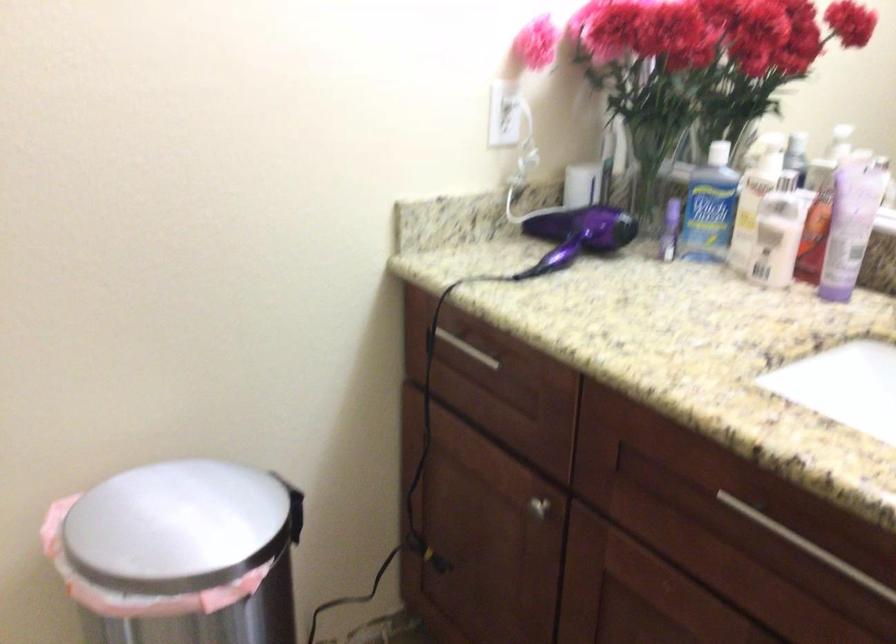
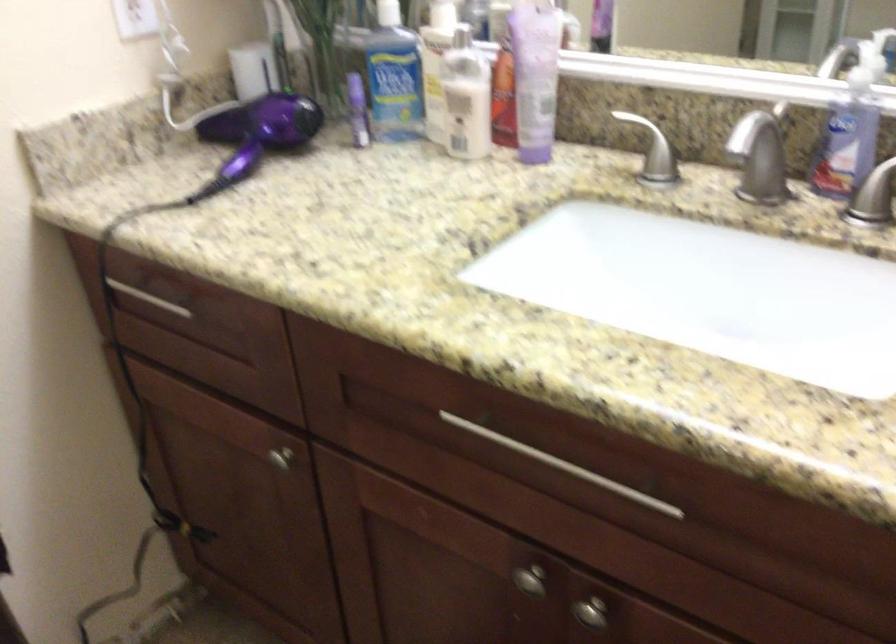
Find the pixel in the second image that matches (461,346) in the first image.

(149, 298)